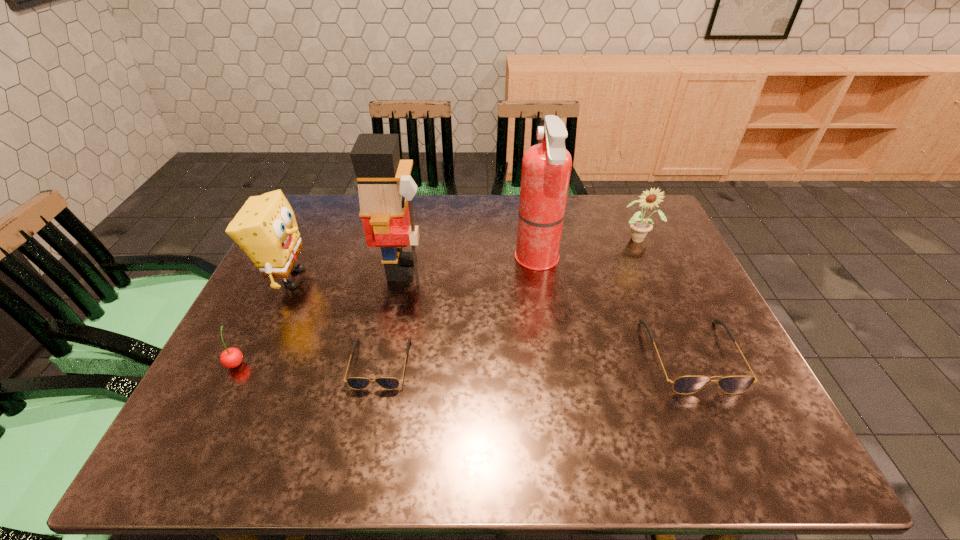
Identify the location of vacant area that lies between the third shortest object and the right sunglasses. The width and height of the screenshot is (960, 540). (464, 359).

Where is `vacant area that lies between the fire extinguisher and the taller sunglasses`? vacant area that lies between the fire extinguisher and the taller sunglasses is located at coordinates coord(614,308).

Where is `vacant area between the third shortest object and the sponge`? The width and height of the screenshot is (960, 540). vacant area between the third shortest object and the sponge is located at coordinates pyautogui.click(x=263, y=320).

This screenshot has width=960, height=540. I want to click on free space between the cherry and the right sunglasses, so click(x=464, y=359).

The width and height of the screenshot is (960, 540). I want to click on empty space that is in between the sunflower and the cherry, so click(438, 300).

I want to click on free space between the shorter sunglasses and the fourth shortest object, so click(x=510, y=301).

Locate an element on the screen. empty space that is in between the cherry and the third tallest object is located at coordinates (263, 320).

Image resolution: width=960 pixels, height=540 pixels. I want to click on vacant point located between the shortest object and the sunflower, so click(510, 301).

The width and height of the screenshot is (960, 540). I want to click on unoccupied position between the fifth tallest object and the fifth shortest object, so click(x=263, y=320).

You are a GUI agent. You are given a task and a screenshot of the screen. Output one action in this format:
    pyautogui.click(x=<x>, y=<y>)
    Task: Click on the object that can be found as the third closest to the sponge
    This screenshot has width=960, height=540.
    Given the screenshot: What is the action you would take?
    (358, 383)